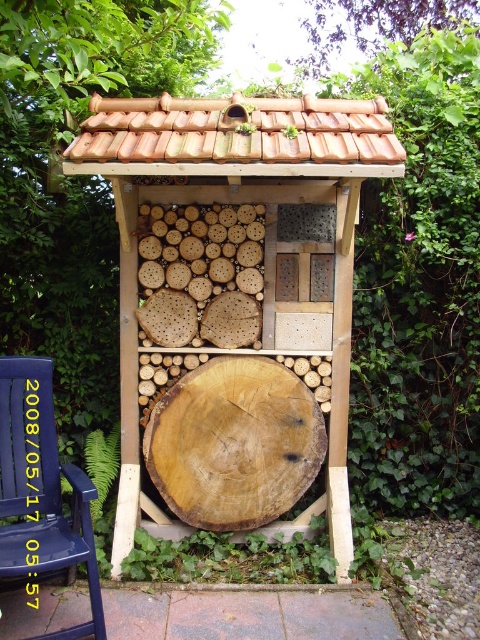
Between wooden insect hotel at center and blue wood chair at lower left, which one has less height?

blue wood chair at lower left

Is point (273, 145) less distant than point (36, 435)?

Yes, point (273, 145) is in front of point (36, 435).

Where is `wooden insect hotel at center`? The width and height of the screenshot is (480, 640). wooden insect hotel at center is located at coordinates (235, 304).

Locate an element on the screen. wooden insect hotel at center is located at coordinates (235, 304).